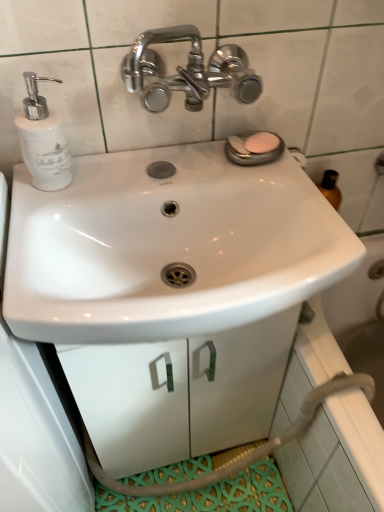
Identify the location of vacant space situated on the left part of pink matte soap at upper right. (182, 153).